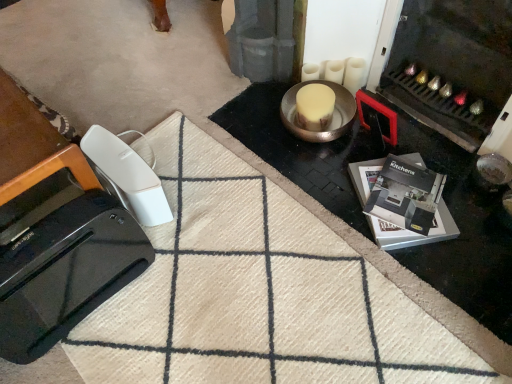
Identify the location of vacant space in black glossy toaster at lower left, the 1th home appliance from the front (from a real-world perspective). Image resolution: width=512 pixels, height=384 pixels. (102, 296).